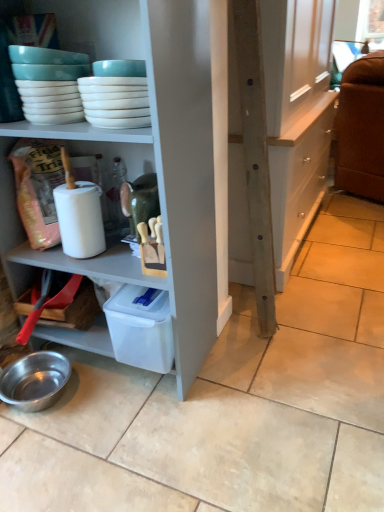
Question: Does white glossy bowls at upper left have a larger size compared to wooden cabinet at center?

Choices:
 (A) yes
 (B) no

Answer: (B)

Question: Is white glossy bowls at upper left positioned behind wooden cabinet at center?

Choices:
 (A) yes
 (B) no

Answer: (B)

Question: From a real-world perspective, is white glossy bowls at upper left over wooden cabinet at center?

Choices:
 (A) no
 (B) yes

Answer: (B)

Question: Is white glossy bowls at upper left next to wooden cabinet at center and touching it?

Choices:
 (A) no
 (B) yes

Answer: (A)

Question: Does white glossy bowls at upper left have a greater width compared to wooden cabinet at center?

Choices:
 (A) no
 (B) yes

Answer: (A)

Question: Can you confirm if white glossy bowls at upper left is shorter than wooden cabinet at center?

Choices:
 (A) yes
 (B) no

Answer: (A)

Question: Is wooden cabinet at center not inside white glossy bowls at upper left?

Choices:
 (A) no
 (B) yes

Answer: (B)

Question: Does wooden cabinet at center come in front of white glossy bowls at upper left?

Choices:
 (A) yes
 (B) no

Answer: (B)

Question: Is wooden cabinet at center to the left of white glossy bowls at upper left from the viewer's perspective?

Choices:
 (A) no
 (B) yes

Answer: (A)

Question: From the image's perspective, is wooden cabinet at center located beneath white glossy bowls at upper left?

Choices:
 (A) yes
 (B) no

Answer: (B)

Question: From a real-world perspective, is wooden cabinet at center below white glossy bowls at upper left?

Choices:
 (A) no
 (B) yes

Answer: (B)

Question: Is wooden cabinet at center shorter than white glossy bowls at upper left?

Choices:
 (A) yes
 (B) no

Answer: (B)

Question: Can you confirm if white glossy bowls at upper left is taller than shiny metallic bowl at lower left?

Choices:
 (A) no
 (B) yes

Answer: (B)